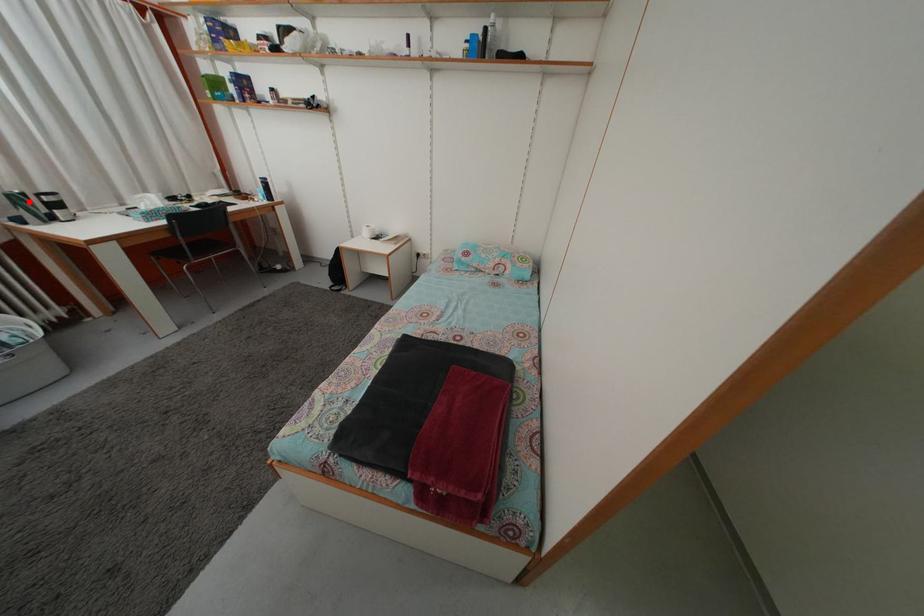
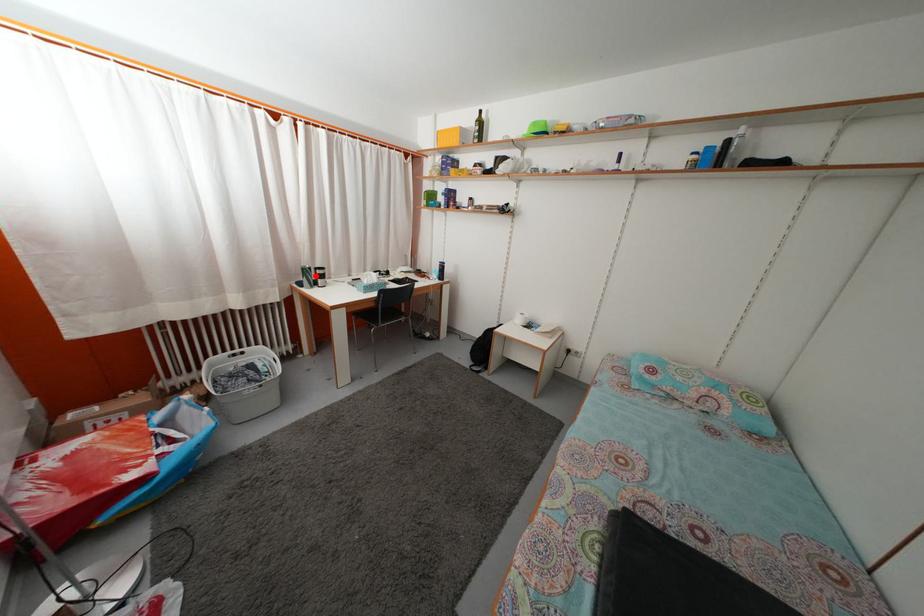
I am providing you with two images of the same scene from different viewpoints. A red point is marked on the first image and another point is marked on the second image. Are the points marked in image1 and image2 representing the same 3D position?

Yes